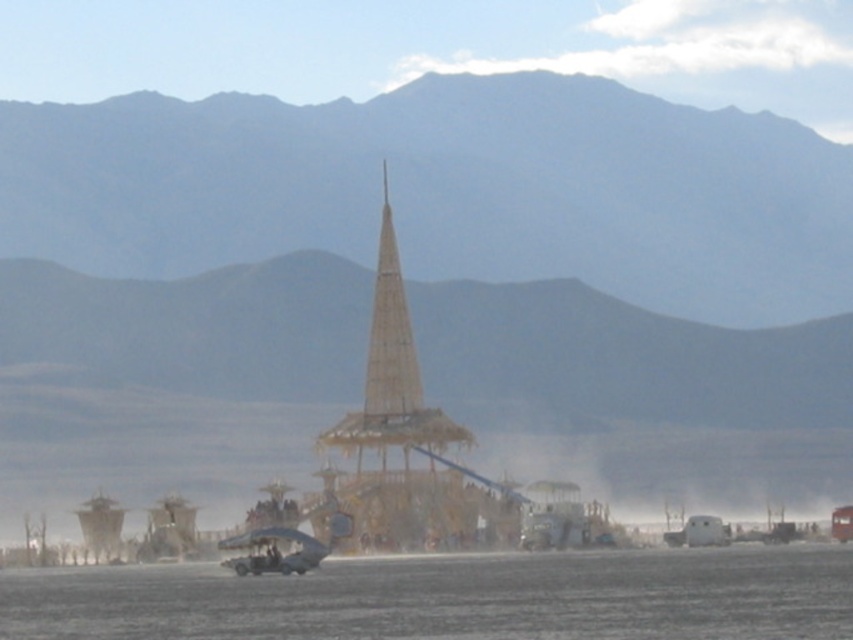
Based on the photo, you are planning to build a small garden between the desert sand mountain at center and the wooden tower at center. The garden requires a minimum of 150 feet of space between them. Can you confirm if there is enough space?

The distance between the desert sand mountain at center and the wooden tower at center is 166.43 feet, which exceeds the required 150 feet. Therefore, there is sufficient space to build the garden.

You are a tourist standing at the entrance of the desert area and see the wooden tower at center and the metallic silver fighter jet at center. Which object is located to the right side of the other?

The wooden tower at center is positioned on the right side of metallic silver fighter jet at center.